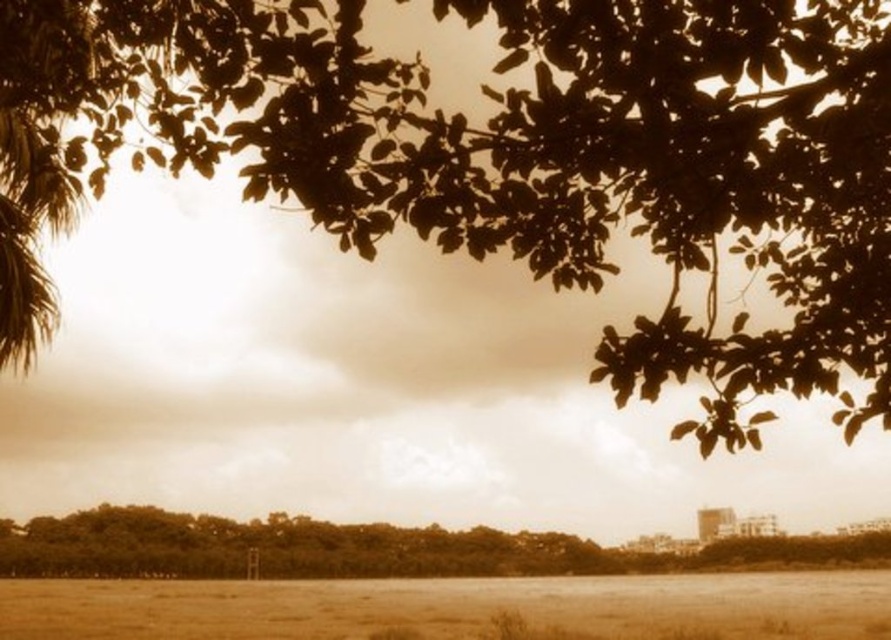
Question: Which point is closer to the camera?

Choices:
 (A) brown leafy branches at upper center
 (B) brown grass at lower center

Answer: (A)

Question: Which point is closer to the camera?

Choices:
 (A) (614, 189)
 (B) (669, 609)
 (C) (438, 566)

Answer: (A)

Question: Among these objects, which one is nearest to the camera?

Choices:
 (A) brown leafy branches at upper center
 (B) brown leafy tree at lower center

Answer: (A)

Question: Is brown leafy branches at upper center further to camera compared to brown grass at lower center?

Choices:
 (A) yes
 (B) no

Answer: (B)

Question: Is brown leafy branches at upper center positioned at the back of brown grass at lower center?

Choices:
 (A) yes
 (B) no

Answer: (B)

Question: Can you confirm if brown leafy branches at upper center is wider than brown grass at lower center?

Choices:
 (A) no
 (B) yes

Answer: (A)